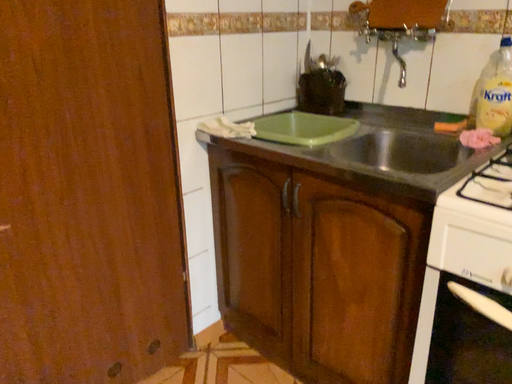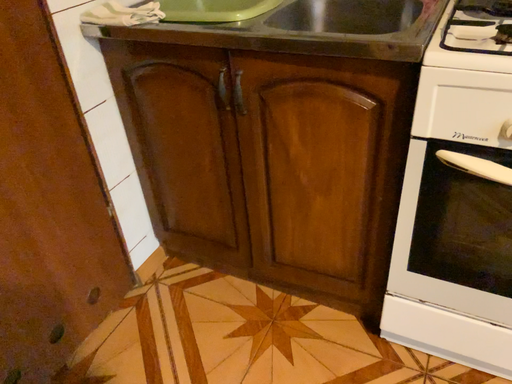
Question: Which way did the camera rotate in the video?

Choices:
 (A) rotated downward
 (B) rotated upward

Answer: (A)